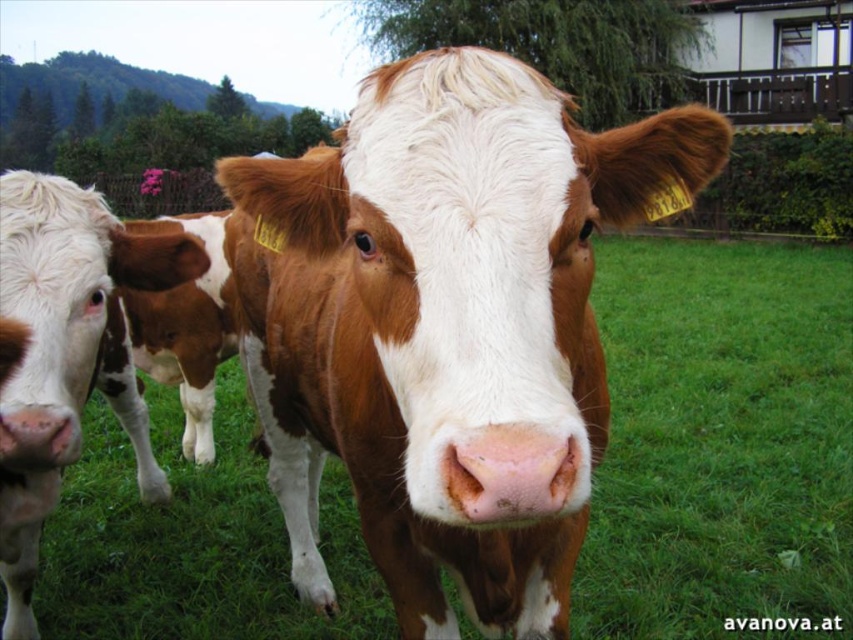
You are standing in a grassy field and want to approach the cow at point (503,545). If you walk straight towards it, how far will you have to walk?

The distance between point (503,545) and the viewer is 1.28 meters, so you will have to walk 1.28 meters to reach the cow at point (503,545).

You are a farmer checking the health of your cows. You notice a specific point at coordinates point (445, 324). Based on the scene, where is this point located on the cow?

The point (445, 324) is located on the brown and white fur at the center of the cow.